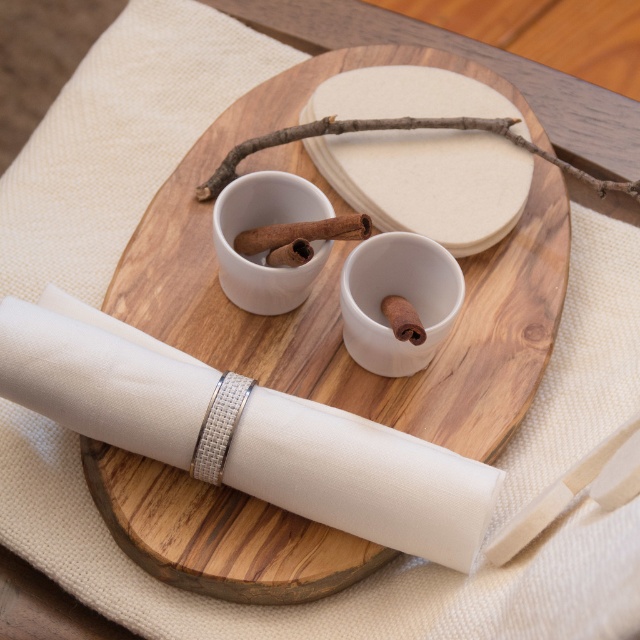
You are a guest at a dinner party and want to reach for the brown wood cinnamon stick at center. However, there is a brown rough twig at upper center in the way. Can you easily access the cinnamon stick without moving the twig?

The brown wood cinnamon stick at center is behind the brown rough twig at upper center, so you cannot easily access it without moving the twig.

You are a guest at a dinner party and want to place a decorative item between the brown rough twig at upper center and the brown wood cinnamon stick at center. Considering their heights, which one should you place the item closer to?

You should place the decorative item closer to the brown wood cinnamon stick at center because the brown rough twig at upper center is much taller, so the cinnamon stick is shorter and the item would be more balanced near it.

You are setting up a table for a small gathering and have a wooden tray at center and a brown wood cinnamon stick at center. Which object will occupy more space on the table?

The wooden tray at center has a larger size compared to the brown wood cinnamon stick at center, so it will occupy more space on the table.